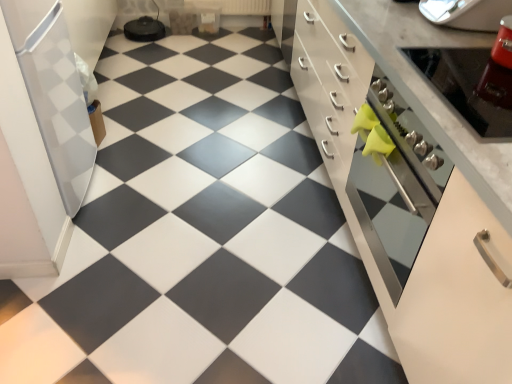
Question: Could you tell me if white glossy cabinet at center is turned towards metallic silver toaster at upper right, which appears as the third appliance when viewed from the left?

Choices:
 (A) no
 (B) yes

Answer: (A)

Question: Considering the relative positions of white glossy cabinet at center and metallic silver toaster at upper right, the 1th appliance viewed from the right, in the image provided, is white glossy cabinet at center in front of metallic silver toaster at upper right, the 1th appliance viewed from the right,?

Choices:
 (A) no
 (B) yes

Answer: (B)

Question: Can you confirm if white glossy cabinet at center is smaller than metallic silver toaster at upper right, which appears as the third appliance when viewed from the left?

Choices:
 (A) yes
 (B) no

Answer: (B)

Question: Is there a large distance between white glossy cabinet at center and metallic silver toaster at upper right, which appears as the third appliance when viewed from the left?

Choices:
 (A) no
 (B) yes

Answer: (A)

Question: From the image's perspective, is white glossy cabinet at center located beneath metallic silver toaster at upper right, which appears as the third appliance when viewed from the left?

Choices:
 (A) no
 (B) yes

Answer: (B)

Question: Can you confirm if white glossy cabinet at center is bigger than metallic silver toaster at upper right, the 1th appliance viewed from the right?

Choices:
 (A) no
 (B) yes

Answer: (B)

Question: Can we say metallic silver oven at right lies outside matte black tile at center?

Choices:
 (A) yes
 (B) no

Answer: (A)

Question: Considering the relative sizes of metallic silver oven at right and matte black tile at center in the image provided, is metallic silver oven at right bigger than matte black tile at center?

Choices:
 (A) no
 (B) yes

Answer: (A)

Question: Is matte black tile at center surrounded by metallic silver oven at right?

Choices:
 (A) no
 (B) yes

Answer: (A)

Question: From a real-world perspective, is metallic silver oven at right physically above matte black tile at center?

Choices:
 (A) yes
 (B) no

Answer: (A)

Question: From the image's perspective, is metallic silver oven at right on matte black tile at center?

Choices:
 (A) yes
 (B) no

Answer: (B)

Question: Can you confirm if metallic silver oven at right is taller than matte black tile at center?

Choices:
 (A) yes
 (B) no

Answer: (A)

Question: Is white glossy cabinet at center turned away from white glossy refrigerator at left, marked as the 1th appliance in a left-to-right arrangement?

Choices:
 (A) yes
 (B) no

Answer: (B)